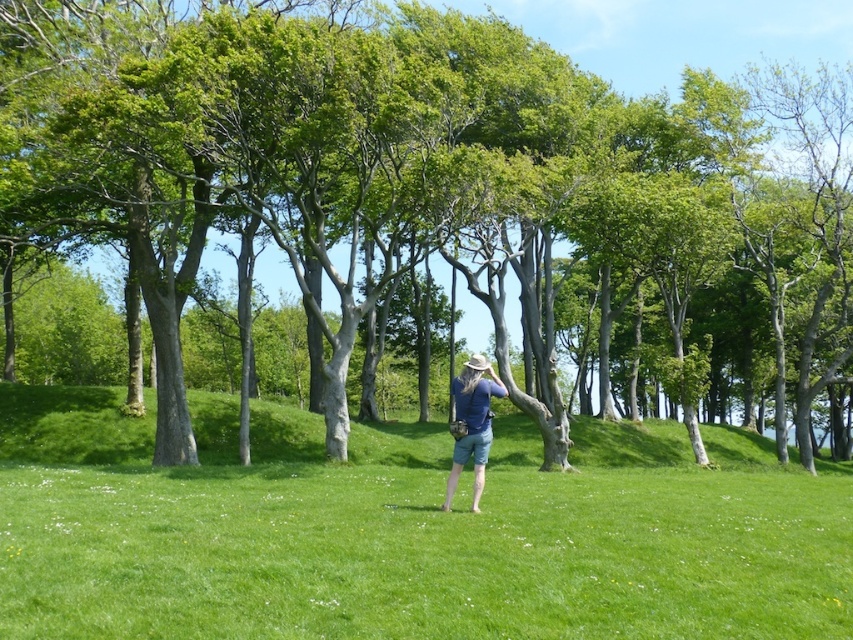
Question: Which object appears closest to the camera in this image?

Choices:
 (A) green smooth tree at center
 (B) green grass at center
 (C) blue denim shorts at center

Answer: (B)

Question: Is green smooth tree at center closer to the viewer compared to green grass at center?

Choices:
 (A) no
 (B) yes

Answer: (A)

Question: Can you confirm if green smooth tree at center is thinner than green grass at center?

Choices:
 (A) no
 (B) yes

Answer: (A)

Question: From the image, what is the correct spatial relationship of green smooth tree at center in relation to green grass at center?

Choices:
 (A) below
 (B) above

Answer: (B)

Question: Which object appears farthest from the camera in this image?

Choices:
 (A) green smooth tree at center
 (B) green grass at center
 (C) blue denim shorts at center

Answer: (A)

Question: Which point is farther to the camera?

Choices:
 (A) green smooth tree at center
 (B) blue denim shorts at center
 (C) green grass at center

Answer: (A)